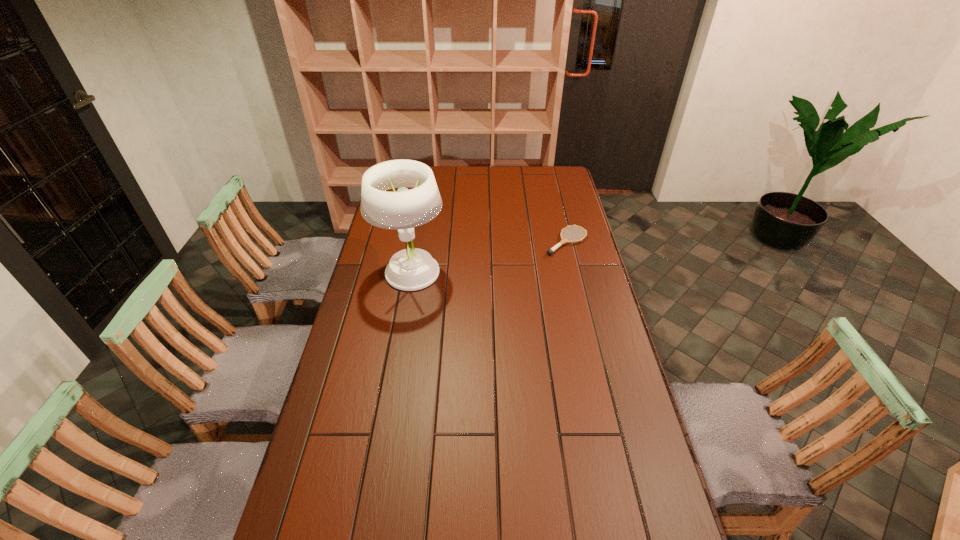
Image resolution: width=960 pixels, height=540 pixels. In order to click on object that is positioned at the right edge in this screenshot , I will do `click(550, 251)`.

This screenshot has height=540, width=960. Find the location of `vacant position at the far edge of the desktop`. vacant position at the far edge of the desktop is located at coordinates (456, 175).

Where is `free space at the left edge`? The width and height of the screenshot is (960, 540). free space at the left edge is located at coordinates (354, 507).

Locate an element on the screen. Image resolution: width=960 pixels, height=540 pixels. vacant space at the right edge is located at coordinates (569, 229).

This screenshot has width=960, height=540. I want to click on empty space between the rightmost object and the icecream, so coord(486,226).

At what (x,y) coordinates should I click in order to perform the action: click on free area in between the rightmost object and the second tallest object. Please return your answer as a coordinate pair (x, y). The image size is (960, 540). Looking at the image, I should click on (486, 226).

The width and height of the screenshot is (960, 540). Find the location of `free spot between the icecream and the tennis racket`. free spot between the icecream and the tennis racket is located at coordinates (486, 226).

Image resolution: width=960 pixels, height=540 pixels. Identify the location of empty space between the tennis racket and the lamp. (489, 258).

Locate an element on the screen. blank region between the farthest object and the tallest object is located at coordinates (408, 242).

At what (x,y) coordinates should I click in order to perform the action: click on object that is the closest one to the second tallest object. Please return your answer as a coordinate pair (x, y). Looking at the image, I should click on click(x=411, y=269).